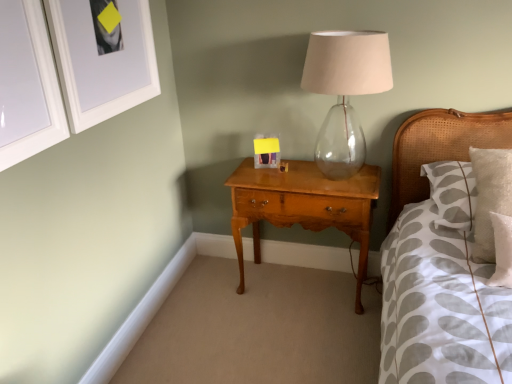
Locate an element on the screen. The height and width of the screenshot is (384, 512). free space on the front side of matte plastic picture frame at center, placed as the third picture frame when sorted from left to right is located at coordinates (262, 178).